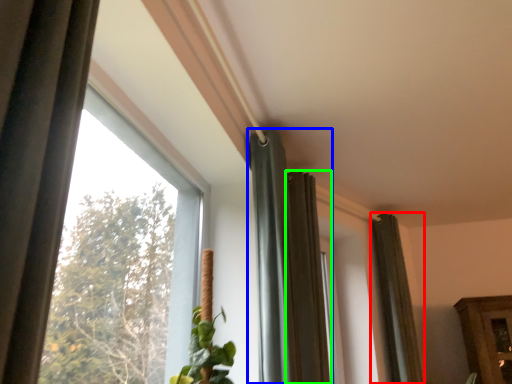
Question: Which object is positioned closest to curtain (highlighted by a red box)? Select from curtain (highlighted by a blue box) and curtain (highlighted by a green box).

Choices:
 (A) curtain
 (B) curtain

Answer: (B)